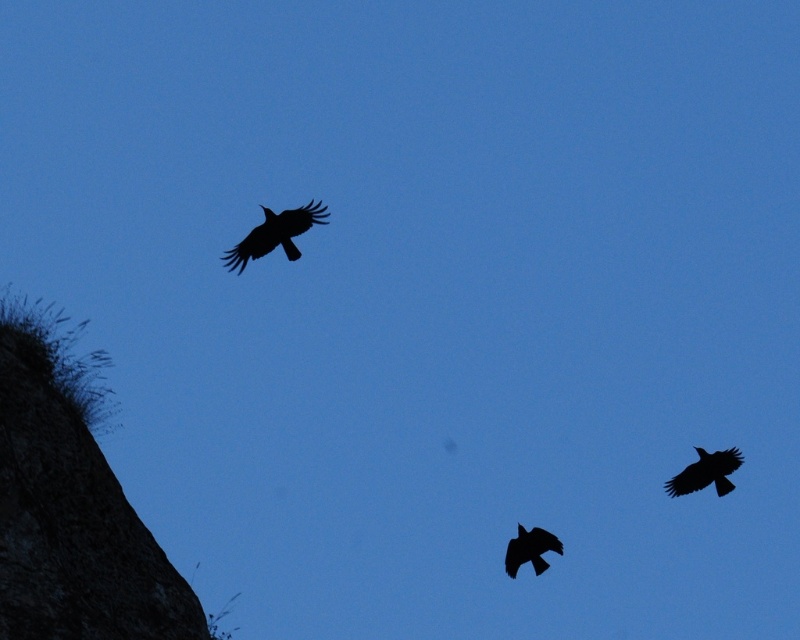
Question: Is black matte vulture at upper center positioned before black matte raven at lower center?

Choices:
 (A) no
 (B) yes

Answer: (B)

Question: Which of these objects is positioned closest to the black matte raven at lower center?

Choices:
 (A) black matte raven at upper right
 (B) black matte vulture at upper center

Answer: (A)

Question: Can you confirm if black matte vulture at upper center is smaller than black matte raven at upper right?

Choices:
 (A) no
 (B) yes

Answer: (A)

Question: Based on their relative distances, which object is nearer to the black matte vulture at upper center?

Choices:
 (A) black matte raven at upper right
 (B) black matte raven at lower center

Answer: (B)

Question: Which of the following is the farthest from the observer?

Choices:
 (A) (277, 244)
 (B) (710, 458)
 (C) (509, 566)

Answer: (B)

Question: Can you confirm if black matte raven at upper right is positioned to the left of black matte raven at lower center?

Choices:
 (A) no
 (B) yes

Answer: (A)